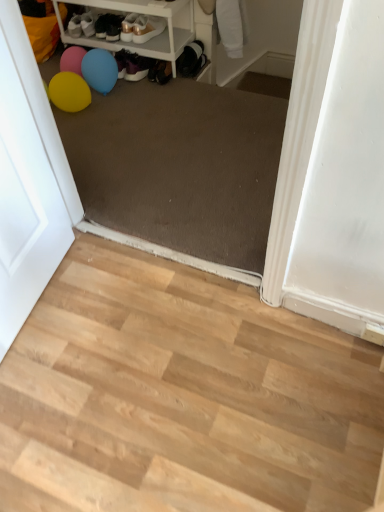
The image size is (384, 512). In order to click on free spot in front of matte white screen door at left in this screenshot , I will do `click(68, 403)`.